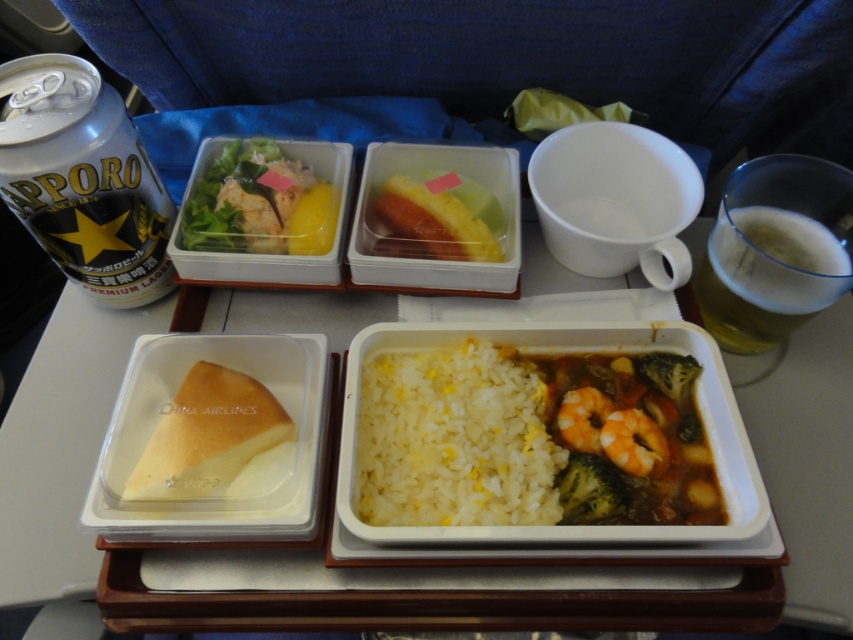
Does translucent plastic cheese at center appear over yellow matte pineapple at center?

No, translucent plastic cheese at center is not above yellow matte pineapple at center.

Is translucent plastic cheese at center positioned at the back of yellow matte pineapple at center?

No, it is in front of yellow matte pineapple at center.

Where is `translucent plastic cheese at center`? This screenshot has width=853, height=640. translucent plastic cheese at center is located at coordinates (207, 435).

Is yellow matte pineapple at center above green matte broccoli at center?

Yes, yellow matte pineapple at center is above green matte broccoli at center.

Can you confirm if yellow matte pineapple at center is positioned to the left of green matte broccoli at center?

Yes, yellow matte pineapple at center is to the left of green matte broccoli at center.

Which is in front, point (456, 202) or point (582, 522)?

Point (582, 522) is more forward.

At what (x,y) coordinates should I click in order to perform the action: click on yellow matte pineapple at center. Please return your answer as a coordinate pair (x, y). This screenshot has height=640, width=853. Looking at the image, I should click on (440, 216).

Is point (440, 404) positioned behind point (91, 132)?

Yes, point (440, 404) is farther from viewer.

Which is in front, point (434, 467) or point (32, 144)?

Point (32, 144) is more forward.

Where is `white matte rice at center`? The image size is (853, 640). white matte rice at center is located at coordinates (454, 440).